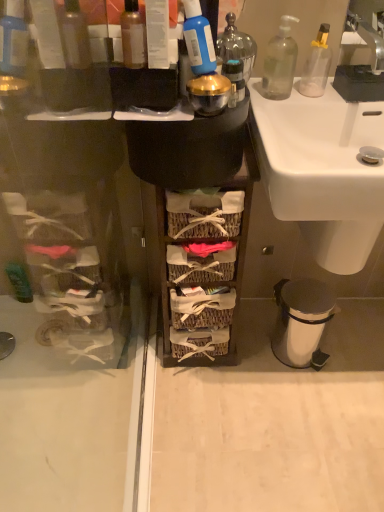
Question: Considering their positions, is translucent glass bottle at upper center, the 2th bottle in the left-to-right sequence, located in front of or behind white ceramic sink at center?

Choices:
 (A) behind
 (B) front

Answer: (A)

Question: From the image's perspective, is translucent glass bottle at upper center, which appears as the 2th bottle when viewed from the right, positioned above or below white ceramic sink at center?

Choices:
 (A) below
 (B) above

Answer: (B)

Question: Which object is the farthest from the transparent glass soap dispenser at upper right, which is the 3th bottle in left-to-right order?

Choices:
 (A) woven wood basket at center, arranged as the 2th cabinetry when viewed from the left
 (B) blue plastic bottle at upper center
 (C) silver metallic faucet at upper right
 (D) white plastic trash can at lower right
 (E) matte black cabinet at left, which is the 2th cabinetry from right to left

Answer: (D)

Question: Considering the real-world distances, which object is closest to the woven wood basket at center, arranged as the 2th cabinetry when viewed from the left?

Choices:
 (A) transparent glass soap dispenser at upper right, which is the first bottle from back to front
 (B) white plastic trash can at lower right
 (C) green matte bottle at left, the 1th toiletry when ordered from back to front
 (D) matte black cabinet at left, which ranks as the 1th cabinetry in left-to-right order
 (E) translucent plastic bottle at upper center, which ranks as the 3th bottle in right-to-left order

Answer: (D)